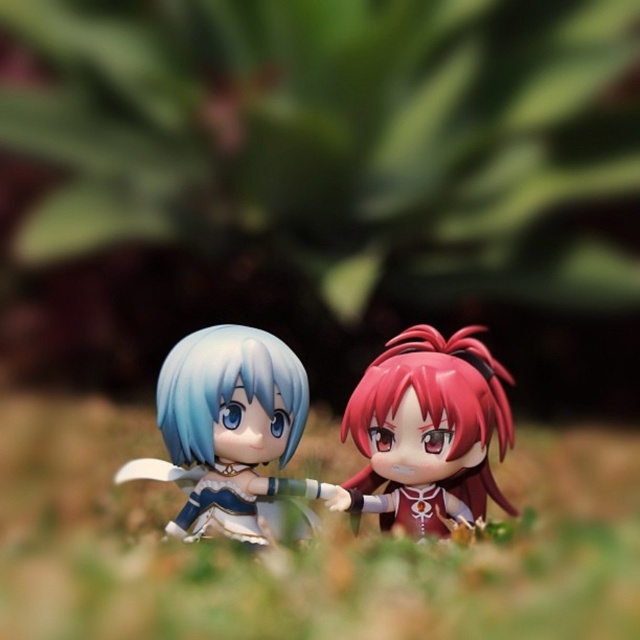
Question: Is satin red hair at center thinner than satin white doll at center?

Choices:
 (A) yes
 (B) no

Answer: (A)

Question: Which is nearer to the satin white doll at center?

Choices:
 (A) green grass at center
 (B) semi-glossy blue hair at center

Answer: (B)

Question: Which point appears closest to the camera in this image?

Choices:
 (A) (273, 355)
 (B) (481, 484)
 (C) (52, 536)
 (D) (182, 468)

Answer: (A)

Question: Can you confirm if green grass at center is smaller than satin red hair at center?

Choices:
 (A) no
 (B) yes

Answer: (A)

Question: Which is farther from the satin red hair at center?

Choices:
 (A) green grass at center
 (B) semi-glossy blue hair at center
 (C) satin white doll at center

Answer: (A)

Question: Is green grass at center below semi-glossy blue hair at center?

Choices:
 (A) yes
 (B) no

Answer: (A)